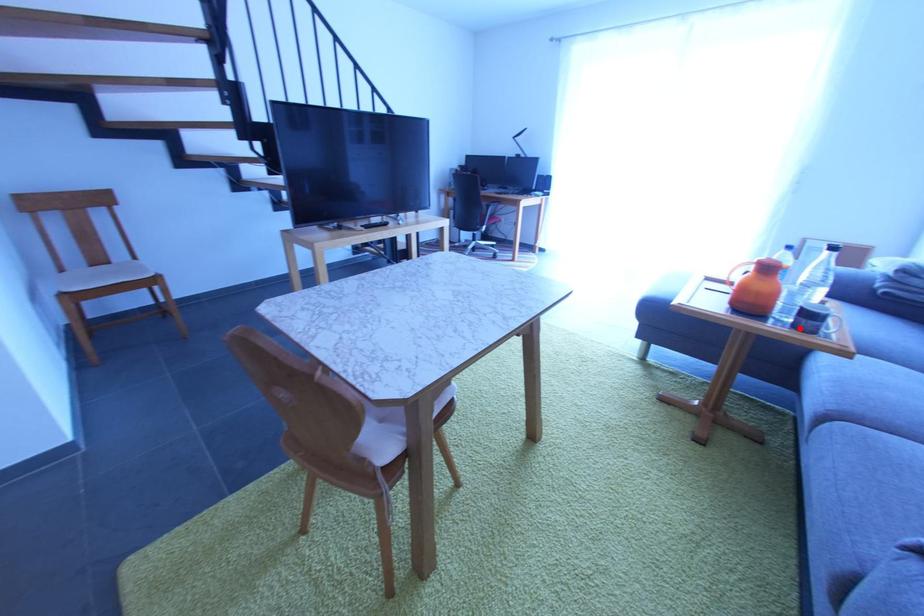
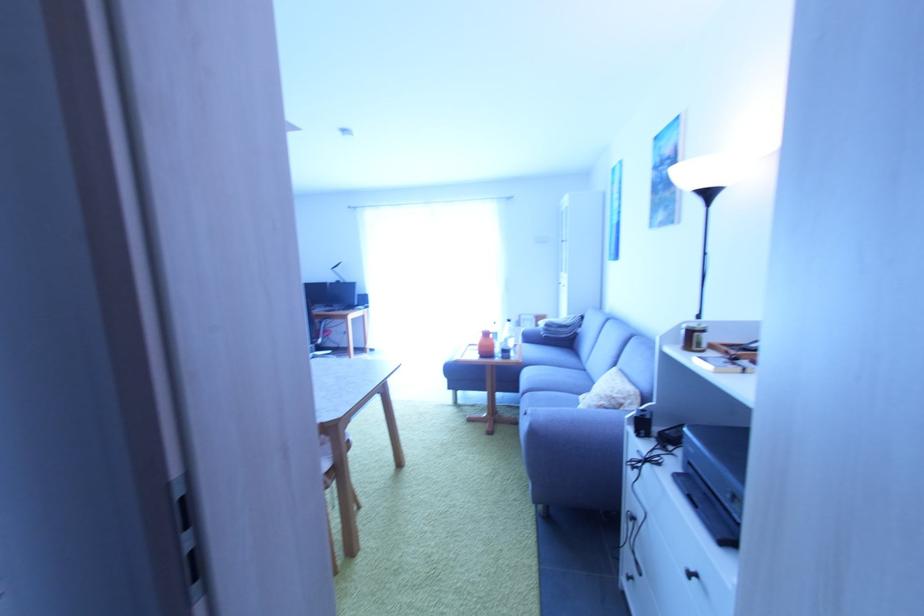
Find the pixel in the second image that matches the highlighted location in the first image.

(507, 360)